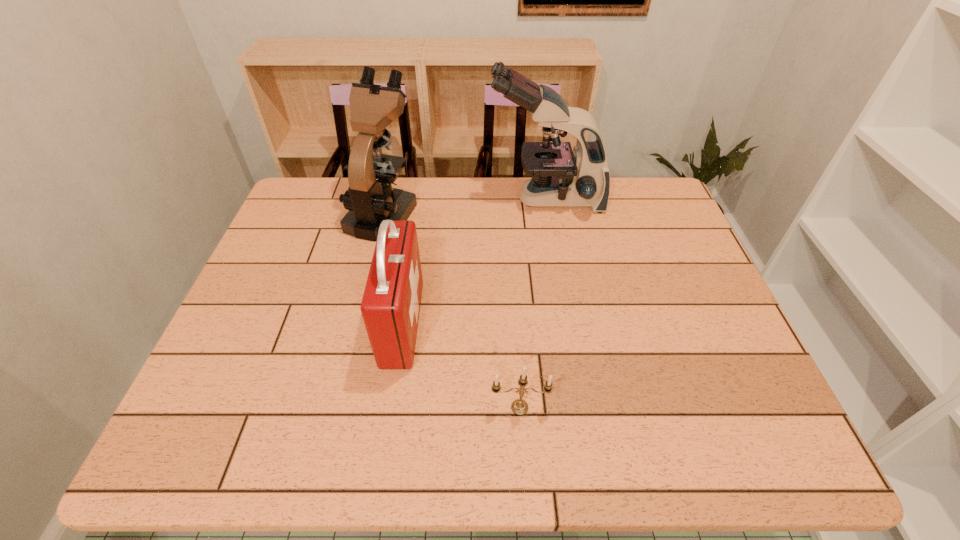
Locate an element on the screen. the right microscope is located at coordinates (560, 177).

Find the location of `the left microscope`. the left microscope is located at coordinates (370, 198).

Identify the location of the second shortest object. (390, 307).

You are a GUI agent. You are given a task and a screenshot of the screen. Output one action in this format:
    pyautogui.click(x=<x>, y=<y>)
    Task: Click on the third farthest object
    
    Given the screenshot: What is the action you would take?
    point(390,307)

Identify the location of the nearest object. (519, 407).

I want to click on candle, so click(519, 407).

Locate an element on the screen. The height and width of the screenshot is (540, 960). free region located 0.170m through the eyepieces of the right microscope is located at coordinates (436, 199).

Image resolution: width=960 pixels, height=540 pixels. I want to click on free space located through the eyepieces of the right microscope, so [376, 199].

I want to click on free space located through the eyepieces of the right microscope, so click(458, 199).

This screenshot has height=540, width=960. Identify the location of vacant space located on the front of the left microscope. (346, 361).